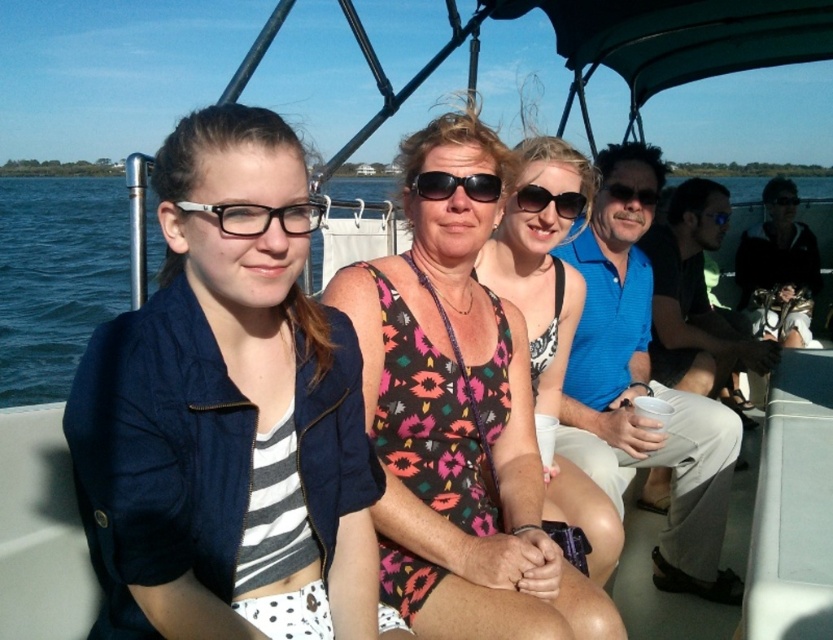
Question: Which point appears farthest from the camera in this image?

Choices:
 (A) click(722, 216)
 (B) click(769, 205)
 (C) click(512, 196)

Answer: (B)

Question: Does printed fabric dress at center appear over blue rubber goggles at upper center?

Choices:
 (A) yes
 (B) no

Answer: (B)

Question: Which of the following is the closest to the observer?

Choices:
 (A) (711, 216)
 (B) (791, 204)

Answer: (A)

Question: Can you confirm if matte black glasses at upper left is thinner than black plastic goggles at upper right?

Choices:
 (A) no
 (B) yes

Answer: (A)

Question: Can you confirm if printed fabric dress at center is positioned above floral print tank top at center?

Choices:
 (A) no
 (B) yes

Answer: (A)

Question: Among these points, which one is nearest to the camera?

Choices:
 (A) (717, 216)
 (B) (582, 497)
 (C) (238, 289)

Answer: (C)